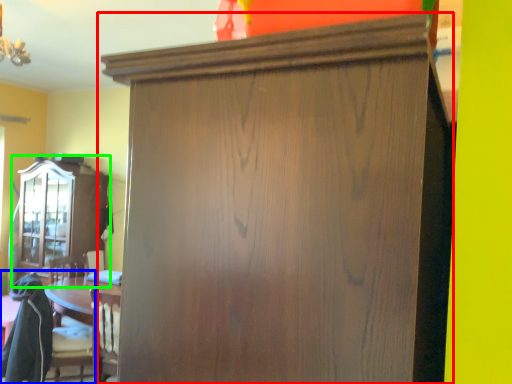
Question: Which object is the closest to the cupboard (highlighted by a red box)? Choose among these: swivel chair (highlighted by a blue box) or cabinetry (highlighted by a green box).

Choices:
 (A) swivel chair
 (B) cabinetry

Answer: (A)